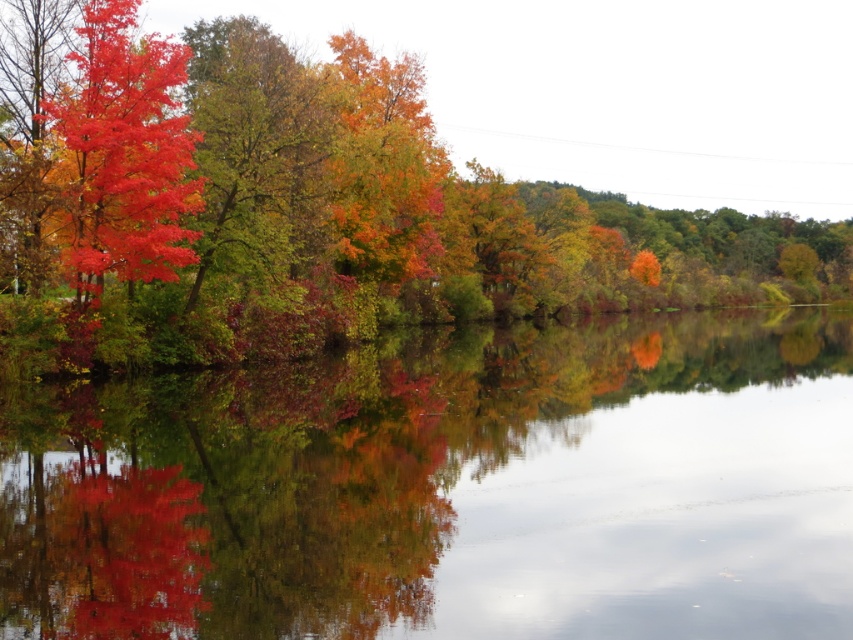
Question: Can you confirm if shiny red leaves at left is positioned to the right of matte red tree at lower left?

Choices:
 (A) yes
 (B) no

Answer: (A)

Question: Which object is the farthest from the matte red leaves at left?

Choices:
 (A) matte red tree at lower left
 (B) transparent glass water at center
 (C) shiny red leaves at left

Answer: (C)

Question: Which object is closer to the camera taking this photo?

Choices:
 (A) shiny red leaves at left
 (B) transparent glass water at center
 (C) matte red leaves at left
 (D) matte red tree at lower left

Answer: (B)

Question: Does transparent glass water at center have a lesser width compared to shiny red leaves at left?

Choices:
 (A) yes
 (B) no

Answer: (A)

Question: Which point is farther to the camera?

Choices:
 (A) (775, 435)
 (B) (73, 211)

Answer: (B)

Question: From the image, what is the correct spatial relationship of shiny red leaves at left in relation to matte red leaves at left?

Choices:
 (A) below
 (B) above

Answer: (B)